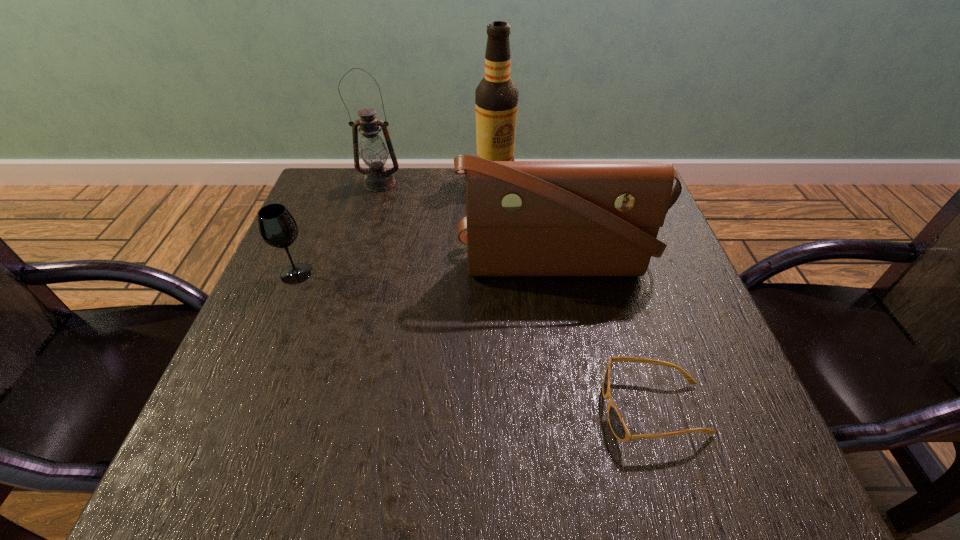
Locate an element on the screen. The height and width of the screenshot is (540, 960). blank space located on the front of the fourth tallest object is located at coordinates (279, 314).

The width and height of the screenshot is (960, 540). Find the location of `vacant space situated on the front-facing side of the nearest object`. vacant space situated on the front-facing side of the nearest object is located at coordinates (436, 409).

The width and height of the screenshot is (960, 540). I want to click on vacant space located 0.150m on the front-facing side of the nearest object, so click(515, 409).

Where is `vacant space located on the front-facing side of the nearest object`? vacant space located on the front-facing side of the nearest object is located at coordinates (382, 409).

The height and width of the screenshot is (540, 960). Find the location of `alcohol positioned at the far edge`. alcohol positioned at the far edge is located at coordinates (496, 98).

Where is `oil lamp that is at the far edge`? oil lamp that is at the far edge is located at coordinates (373, 151).

Where is `object that is at the near edge`? object that is at the near edge is located at coordinates (618, 427).

Where is `oil lamp at the left edge`? The height and width of the screenshot is (540, 960). oil lamp at the left edge is located at coordinates (373, 151).

Where is `wineglass located in the left edge section of the desktop`? Image resolution: width=960 pixels, height=540 pixels. wineglass located in the left edge section of the desktop is located at coordinates (277, 227).

I want to click on satchel situated at the right edge, so click(523, 218).